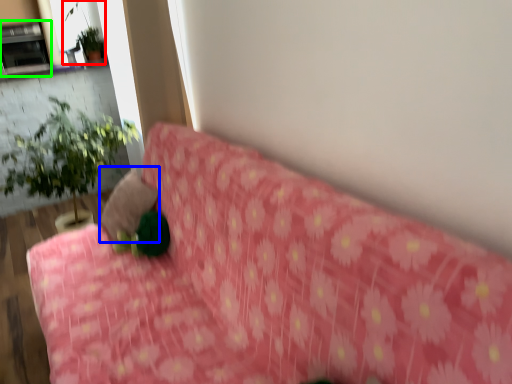
Question: Based on their relative distances, which object is nearer to plant (highlighted by a red box)? Choose from pillow (highlighted by a blue box) and fireplace (highlighted by a green box).

Choices:
 (A) pillow
 (B) fireplace

Answer: (B)